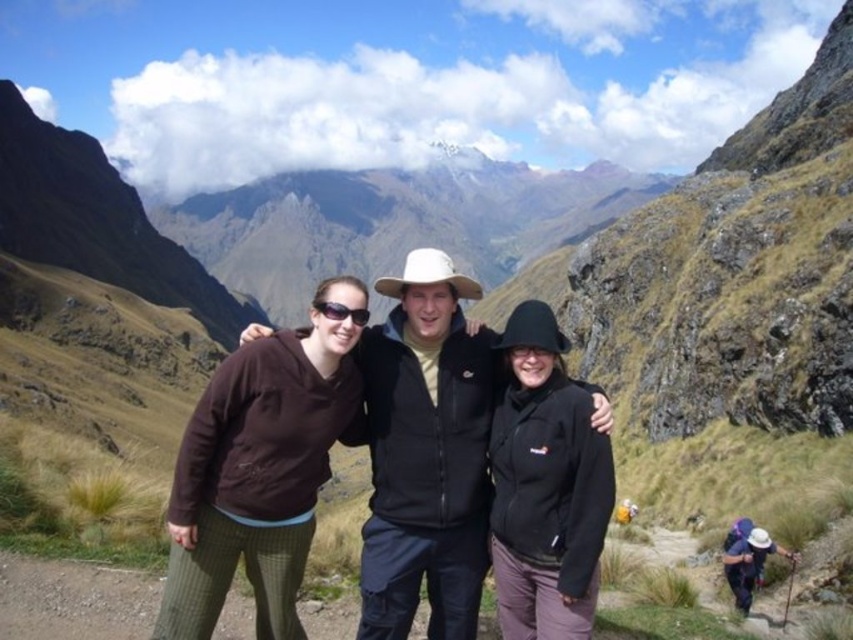
Between brown fleece at center and black fleece jacket at center, which one is positioned lower?

Positioned lower is black fleece jacket at center.

Is brown fleece at center above black fleece jacket at center?

Correct, brown fleece at center is located above black fleece jacket at center.

Who is more distant from viewer, (x=318, y=449) or (x=549, y=348)?

The point (x=549, y=348) is more distant.

The image size is (853, 640). In order to click on brown fleece at center in this screenshot , I will do `click(260, 467)`.

Is brown fleece at center below black matte jacket at center?

Correct, brown fleece at center is located below black matte jacket at center.

Measure the distance between point (244,408) and camera.

Point (244,408) and camera are 32.25 meters apart.

Does point (258, 634) come in front of point (451, 621)?

Yes, point (258, 634) is in front of point (451, 621).

This screenshot has width=853, height=640. What are the coordinates of `brown fleece at center` in the screenshot? It's located at (260, 467).

Is black matte jacket at center taller than black fleece jacket at center?

Indeed, black matte jacket at center has a greater height compared to black fleece jacket at center.

Does point (401, 532) come behind point (554, 448)?

Yes, point (401, 532) is behind point (554, 448).

Locate an element on the screen. The height and width of the screenshot is (640, 853). black matte jacket at center is located at coordinates (426, 452).